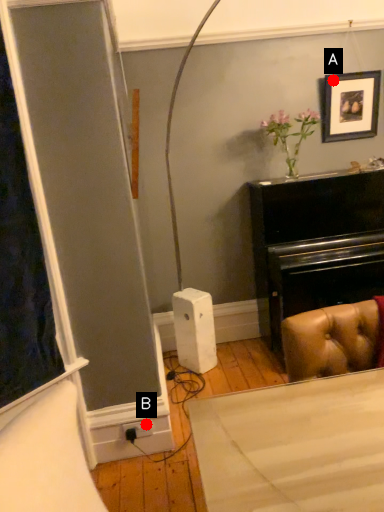
Question: Two points are circled on the image, labeled by A and B beside each circle. Which of the following is the farthest from the observer?

Choices:
 (A) A is further
 (B) B is further

Answer: (A)